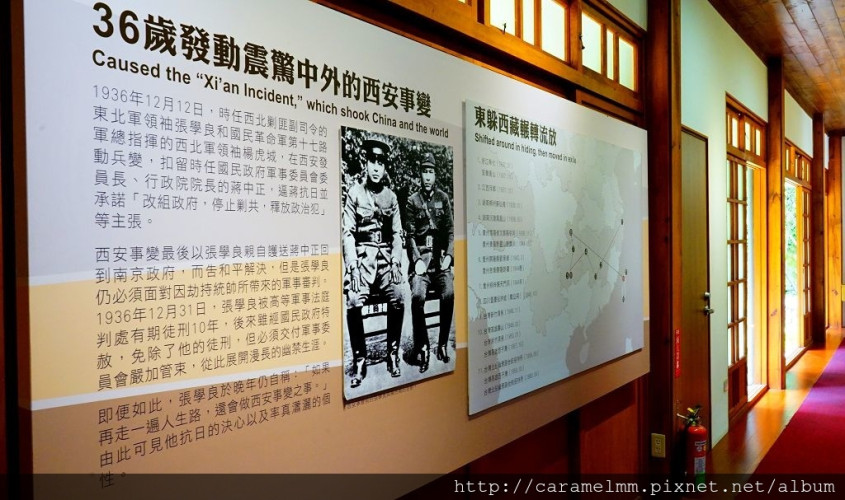
In order to click on wood ceiling in this screenshot , I will do `click(792, 43)`.